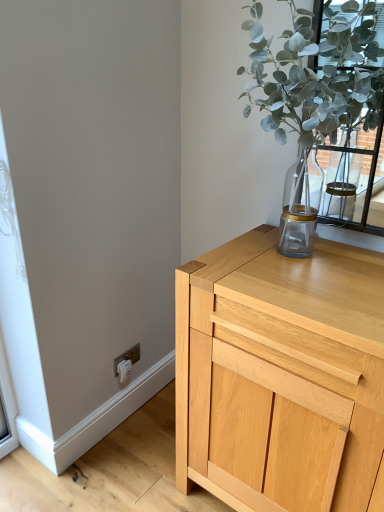
The height and width of the screenshot is (512, 384). What do you see at coordinates (127, 357) in the screenshot?
I see `white plastic electric outlet at lower left` at bounding box center [127, 357].

What do you see at coordinates (280, 375) in the screenshot? Image resolution: width=384 pixels, height=512 pixels. I see `light wood cabinet at upper right` at bounding box center [280, 375].

Find the location of a particular element. white plastic electric outlet at lower left is located at coordinates (127, 357).

Is point (295, 21) closer or farther from the camera than point (115, 371)?

Point (295, 21).

How much distance is there between green leafy plant at upper right and white plastic electric outlet at lower left?

green leafy plant at upper right and white plastic electric outlet at lower left are 3.92 feet apart.

From the image's perspective, does green leafy plant at upper right appear higher than white plastic electric outlet at lower left?

Yes, from the image's perspective, green leafy plant at upper right is on top of white plastic electric outlet at lower left.

Which of these two, green leafy plant at upper right or white plastic electric outlet at lower left, stands taller?

Standing taller between the two is green leafy plant at upper right.

Looking at the image, does light wood cabinet at upper right seem bigger or smaller compared to white plastic electric outlet at lower left?

Clearly, light wood cabinet at upper right is larger in size than white plastic electric outlet at lower left.

Considering the positions of objects light wood cabinet at upper right and white plastic electric outlet at lower left in the image provided, who is more to the right, light wood cabinet at upper right or white plastic electric outlet at lower left?

light wood cabinet at upper right.

From the image's perspective, is light wood cabinet at upper right located above white plastic electric outlet at lower left?

Actually, light wood cabinet at upper right appears below white plastic electric outlet at lower left in the image.

Which is nearer, (279,438) or (130,357)?

The point (279,438) is closer to the camera.

Considering the positions of objects white plastic electric outlet at lower left and green leafy plant at upper right in the image provided, who is more to the left, white plastic electric outlet at lower left or green leafy plant at upper right?

Positioned to the left is white plastic electric outlet at lower left.

Is white plastic electric outlet at lower left spatially inside green leafy plant at upper right, or outside of it?

white plastic electric outlet at lower left is not inside green leafy plant at upper right, it's outside.

Which is closer, (134,351) or (368,15)?

Point (134,351) is positioned farther from the camera compared to point (368,15).

Does point (326, 78) lie in front of point (365, 475)?

No, it is not.

Looking at their sizes, would you say green leafy plant at upper right is wider or thinner than light wood cabinet at upper right?

green leafy plant at upper right is thinner than light wood cabinet at upper right.

Measure the distance between green leafy plant at upper right and light wood cabinet at upper right.

green leafy plant at upper right and light wood cabinet at upper right are 20.07 inches apart from each other.

Is green leafy plant at upper right positioned far away from light wood cabinet at upper right?

green leafy plant at upper right is near light wood cabinet at upper right, not far away.

How many degrees apart are the facing directions of light wood cabinet at upper right and green leafy plant at upper right?

The angle between the facing direction of light wood cabinet at upper right and the facing direction of green leafy plant at upper right is 1.87 degrees.

Is light wood cabinet at upper right not within green leafy plant at upper right?

Yes, light wood cabinet at upper right is located beyond the bounds of green leafy plant at upper right.

Would you say light wood cabinet at upper right is a long distance from green leafy plant at upper right?

That's not correct — light wood cabinet at upper right is a little close to green leafy plant at upper right.

Is light wood cabinet at upper right turned away from green leafy plant at upper right?

That's not correct — light wood cabinet at upper right is not looking away from green leafy plant at upper right.

From a real-world perspective, does white plastic electric outlet at lower left stand above light wood cabinet at upper right?

No.

Considering the relative sizes of white plastic electric outlet at lower left and light wood cabinet at upper right in the image provided, is white plastic electric outlet at lower left wider than light wood cabinet at upper right?

No, white plastic electric outlet at lower left is not wider than light wood cabinet at upper right.

Is point (114, 364) farther from viewer compared to point (198, 450)?

Yes, point (114, 364) is behind point (198, 450).

From the image's perspective, which is below, white plastic electric outlet at lower left or light wood cabinet at upper right?

light wood cabinet at upper right, from the image's perspective.

Where is `houseplant to the right of white plastic electric outlet at lower left`? The width and height of the screenshot is (384, 512). houseplant to the right of white plastic electric outlet at lower left is located at coordinates (316, 81).

Identify the location of electric outlet behind the light wood cabinet at upper right. Image resolution: width=384 pixels, height=512 pixels. (127, 357).

Looking at the image, which one is located closer to green leafy plant at upper right, white plastic electric outlet at lower left or light wood cabinet at upper right?

light wood cabinet at upper right is closer to green leafy plant at upper right.

From the image, which object appears to be nearer to light wood cabinet at upper right, green leafy plant at upper right or white plastic electric outlet at lower left?

Based on the image, green leafy plant at upper right appears to be nearer to light wood cabinet at upper right.

Estimate the real-world distances between objects in this image. Which object is closer to green leafy plant at upper right, light wood cabinet at upper right or white plastic electric outlet at lower left?

The object closer to green leafy plant at upper right is light wood cabinet at upper right.

Which object lies nearer to the anchor point light wood cabinet at upper right, white plastic electric outlet at lower left or green leafy plant at upper right?

Based on the image, green leafy plant at upper right appears to be nearer to light wood cabinet at upper right.

When comparing their distances from white plastic electric outlet at lower left, does green leafy plant at upper right or light wood cabinet at upper right seem further?

green leafy plant at upper right is positioned further to the anchor white plastic electric outlet at lower left.

Estimate the real-world distances between objects in this image. Which object is closer to white plastic electric outlet at lower left, light wood cabinet at upper right or green leafy plant at upper right?

Based on the image, light wood cabinet at upper right appears to be nearer to white plastic electric outlet at lower left.

The width and height of the screenshot is (384, 512). What are the coordinates of `the chest of drawers located between green leafy plant at upper right and white plastic electric outlet at lower left in the depth direction` in the screenshot? It's located at (280, 375).